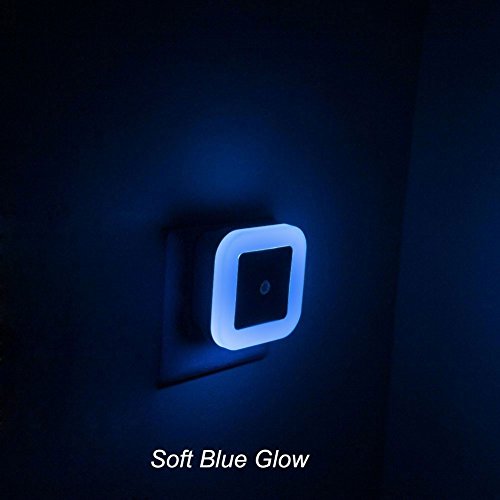
Find the location of `light on wall`. light on wall is located at coordinates (239, 174).